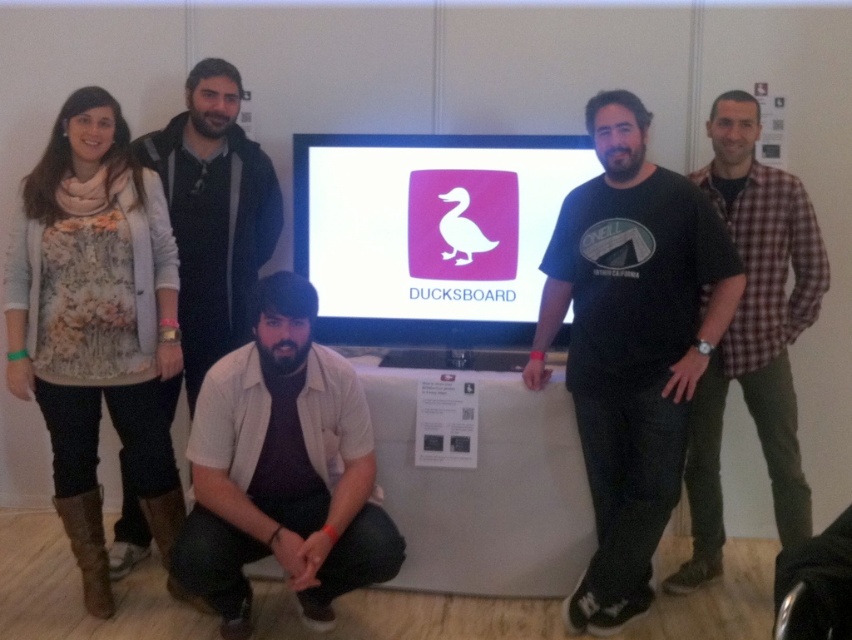
You are a photographer adjusting your camera settings to capture the group photo. The floral fabric top at left and the white glossy screen at center are both in your frame. Which object should you focus on first if you want to ensure the larger one is in sharp focus?

The floral fabric top at left is larger than the white glossy screen at center, so you should focus on the floral fabric top at left first to ensure it is in sharp focus.